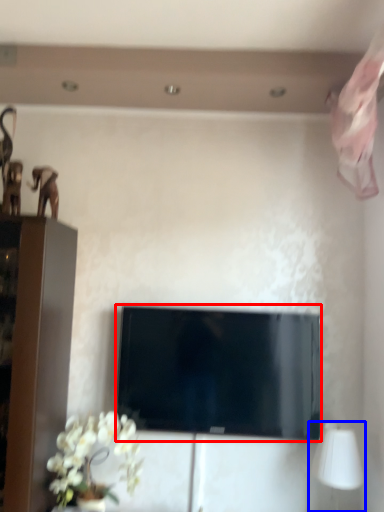
Question: Which point is further to the camera, television (highlighted by a red box) or table lamp (highlighted by a blue box)?

Choices:
 (A) television
 (B) table lamp

Answer: (A)